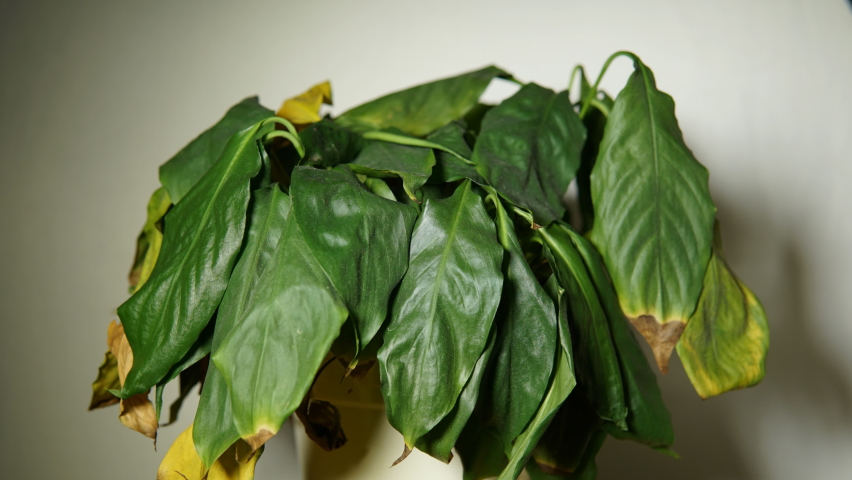
You are a GUI agent. You are given a task and a screenshot of the screen. Output one action in this format:
    pyautogui.click(x=<x>, y=<y>)
    Task: Click on the plant
    
    Given the screenshot: What is the action you would take?
    pyautogui.click(x=405, y=204)